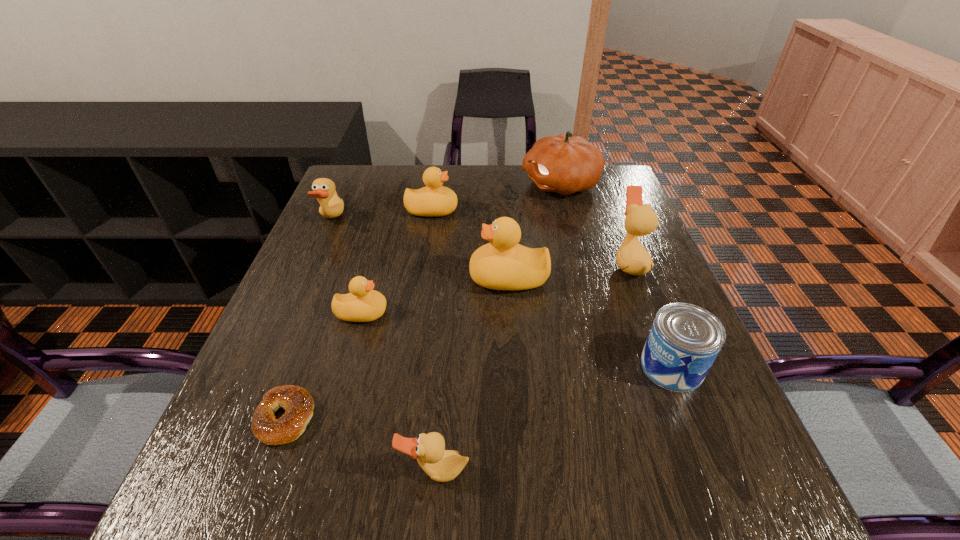
This screenshot has width=960, height=540. Identify the location of empty location between the leftmost tan duck and the biggest tan duck. (480, 241).

You are a GUI agent. You are given a task and a screenshot of the screen. Output one action in this format:
    pyautogui.click(x=<x>, y=<y>)
    Task: Click on the vacant area that lies between the second tan duck from left to right and the pumpkin
    
    Given the screenshot: What is the action you would take?
    pyautogui.click(x=497, y=328)

What are the coordinates of `object that is the sixth closest to the second tan duck from right to left` in the screenshot? It's located at (332, 206).

Find the location of a particular element. This screenshot has width=960, height=540. object that is the seventh closest to the farthest yellow duck is located at coordinates (x=684, y=341).

The height and width of the screenshot is (540, 960). What are the coordinates of `duck that is the second closest to the pumpkin` in the screenshot? It's located at (434, 200).

Identify which duck is the second nearest to the second smallest tan duck. Please provide its 2D coordinates. Your answer should be formatted as a tuple, i.e. [(x, y)], where the tuple contains the x and y coordinates of a point satisfying the conditions above.

[(363, 304)]

The image size is (960, 540). Find the location of `yellow duck that is the second closest to the farthest yellow duck`. yellow duck that is the second closest to the farthest yellow duck is located at coordinates (363, 304).

At what (x,y) coordinates should I click in order to perform the action: click on yellow duck that is the closest to the brown bagel. Please return your answer as a coordinate pair (x, y). This screenshot has height=540, width=960. Looking at the image, I should click on (363, 304).

Find the location of a particular element. tan duck that is the second closest to the nearest duck is located at coordinates (332, 206).

At what (x,y) coordinates should I click in order to perform the action: click on the second closest tan duck to the nearest object. Please return your answer as a coordinate pair (x, y). Looking at the image, I should click on (332, 206).